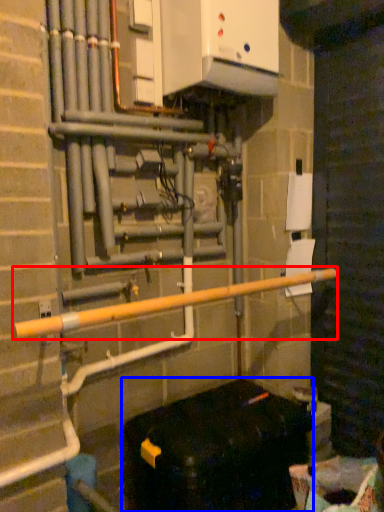
Question: Among these objects, which one is farthest to the camera, rail (highlighted by a red box) or furniture (highlighted by a blue box)?

Choices:
 (A) rail
 (B) furniture

Answer: (B)